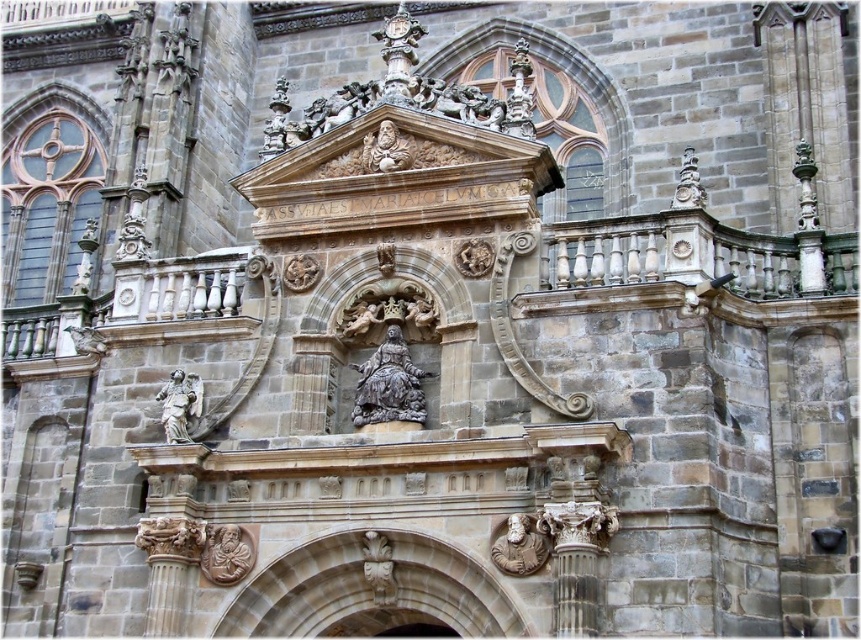
Can you confirm if brown stone bust at lower right is smaller than polished bronze angel at lower left?

Yes, brown stone bust at lower right is smaller than polished bronze angel at lower left.

Which is more to the right, brown stone bust at lower right or polished bronze angel at lower left?

From the viewer's perspective, brown stone bust at lower right appears more on the right side.

Is point (499, 554) less distant than point (175, 388)?

Yes, point (499, 554) is closer to viewer.

This screenshot has width=861, height=640. Find the location of `brown stone bust at lower right`. brown stone bust at lower right is located at coordinates (519, 547).

Is gray stone statue at center closer to camera compared to brown stone sculpture at lower left?

No.

Who is higher up, gray stone statue at center or brown stone sculpture at lower left?

Positioned higher is gray stone statue at center.

You are a GUI agent. You are given a task and a screenshot of the screen. Output one action in this format:
    pyautogui.click(x=<x>, y=<y>)
    Task: Click on the gray stone statue at center
    
    Given the screenshot: What is the action you would take?
    pyautogui.click(x=389, y=385)

Is point (414, 381) closer to viewer compared to point (177, 412)?

Yes.

Does gray stone statue at center have a greater width compared to polished bronze angel at lower left?

Yes.

Does point (367, 401) come behind point (194, 417)?

No, it is not.

Locate an element on the screen. The height and width of the screenshot is (640, 861). gray stone statue at center is located at coordinates click(x=389, y=385).